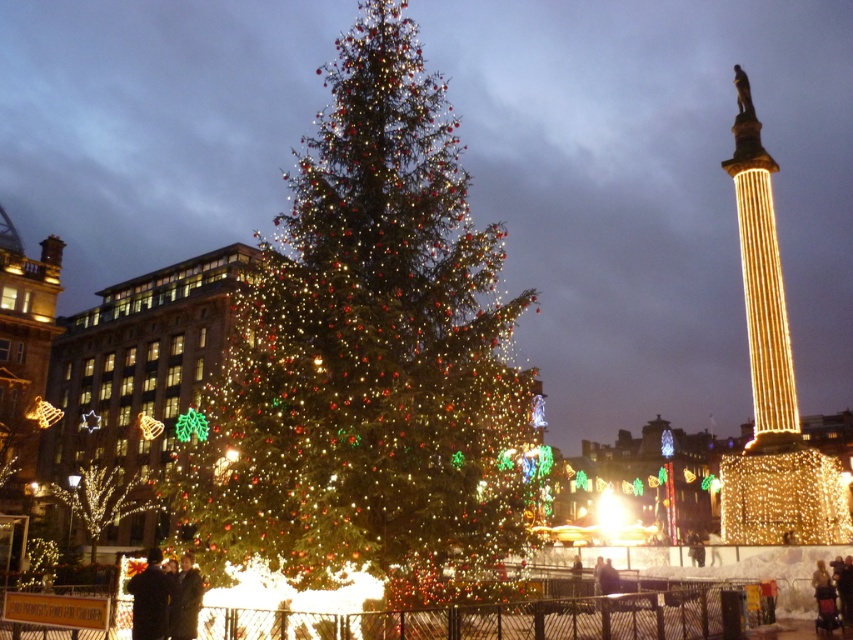
Question: Does illuminated golden tree at lower left have a greater width compared to dark wool coat at lower left?

Choices:
 (A) yes
 (B) no

Answer: (A)

Question: Which point is farther to the camera?

Choices:
 (A) (83, 500)
 (B) (175, 592)
 (C) (398, 509)
 (D) (166, 621)

Answer: (A)

Question: Which point is closer to the camera?

Choices:
 (A) dark wool coat at lower left
 (B) illuminated golden tree at lower left
 (C) green matte christmas tree at center

Answer: (A)

Question: Observing the image, what is the correct spatial positioning of green matte christmas tree at center in reference to illuminated golden tree at lower left?

Choices:
 (A) above
 (B) below

Answer: (A)

Question: Which object is the farthest from the dark wool coat at lower left?

Choices:
 (A) illuminated golden tree at lower left
 (B) dark brown coat at lower center

Answer: (A)

Question: Where is illuminated golden tree at lower left located in relation to dark brown coat at lower center in the image?

Choices:
 (A) above
 (B) below

Answer: (B)